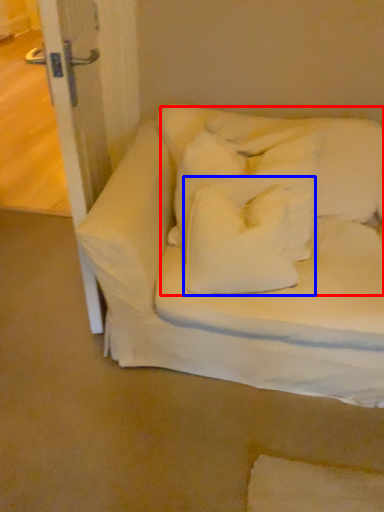
Question: Which object appears closest to the camera in this image, bedding (highlighted by a red box) or pillow (highlighted by a blue box)?

Choices:
 (A) bedding
 (B) pillow

Answer: (B)